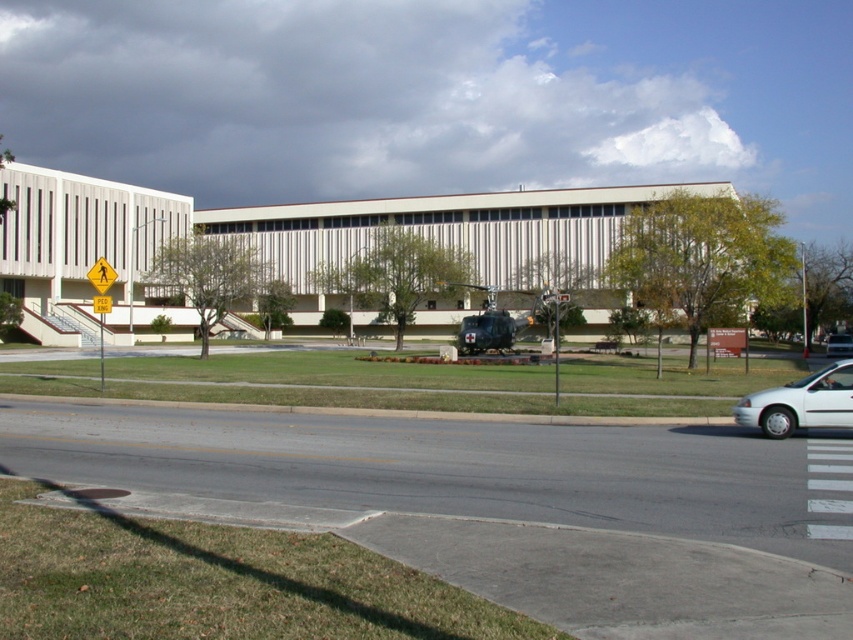
Is white matte van at lower right positioned before yellow reflective pedestrian crossing sign at upper center?

Yes.

Is point (799, 419) closer to camera compared to point (91, 285)?

Yes, it is in front of point (91, 285).

Which is in front, point (848, 404) or point (102, 259)?

Point (848, 404) is more forward.

Where is `white matte van at lower right`? The image size is (853, 640). white matte van at lower right is located at coordinates (801, 403).

Looking at this image, does white matte van at lower right have a greater height compared to white matte sedan at center?

In fact, white matte van at lower right may be shorter than white matte sedan at center.

Does white matte van at lower right appear on the left side of white matte sedan at center?

Correct, you'll find white matte van at lower right to the left of white matte sedan at center.

Measure the distance between point (737, 420) and camera.

15.76 meters

The image size is (853, 640). What are the coordinates of `white matte van at lower right` in the screenshot? It's located at (801, 403).

Between yellow reflective pedestrian crossing sign at upper center and white matte sedan at center, which one is positioned higher?

yellow reflective pedestrian crossing sign at upper center is above.

Can you confirm if yellow reflective pedestrian crossing sign at upper center is taller than white matte sedan at center?

Yes, yellow reflective pedestrian crossing sign at upper center is taller than white matte sedan at center.

Which is in front, point (97, 285) or point (833, 337)?

Point (97, 285) is in front.

Where is `yellow reflective pedestrian crossing sign at upper center`? The image size is (853, 640). yellow reflective pedestrian crossing sign at upper center is located at coordinates 102,275.